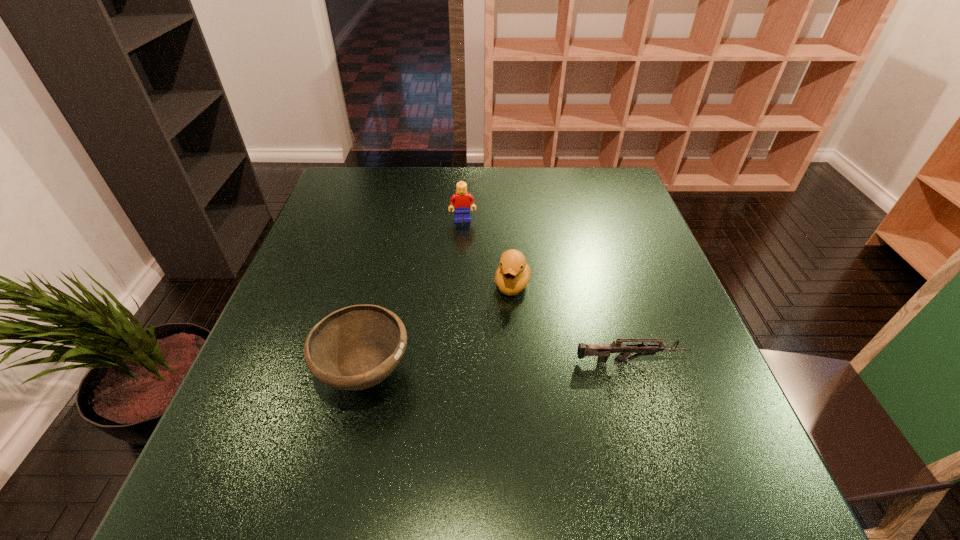
The image size is (960, 540). In order to click on vacant position located 0.050m on the face of the farthest object in this screenshot , I will do `click(465, 234)`.

Locate an element on the screen. free location located on the face of the duckling is located at coordinates (503, 329).

Image resolution: width=960 pixels, height=540 pixels. I want to click on vacant space located on the face of the duckling, so click(477, 435).

This screenshot has height=540, width=960. What are the coordinates of `vacant region located 0.340m on the face of the duckling` in the screenshot? It's located at (476, 441).

I want to click on object that is at the near edge, so click(x=354, y=348).

Where is `object that is at the left edge`? Image resolution: width=960 pixels, height=540 pixels. object that is at the left edge is located at coordinates (354, 348).

Locate an element on the screen. The image size is (960, 540). object that is at the right edge is located at coordinates (603, 351).

Locate an element on the screen. The image size is (960, 540). object that is at the near left corner is located at coordinates (354, 348).

This screenshot has width=960, height=540. What are the coordinates of `free spot at the far edge of the desktop` in the screenshot? It's located at (575, 189).

The image size is (960, 540). What are the coordinates of `vacant space at the left edge` in the screenshot? It's located at (284, 304).